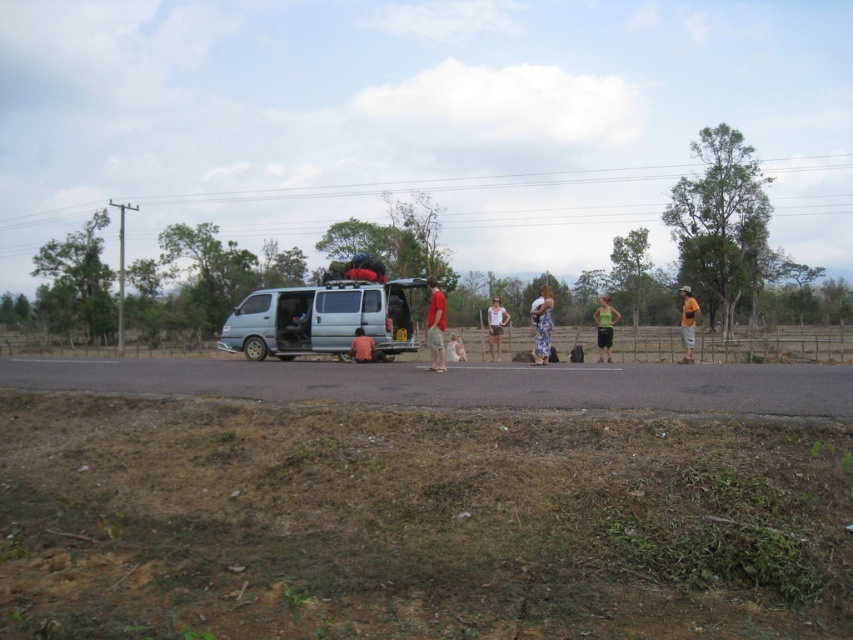
Question: Among these points, which one is farthest from the camera?

Choices:
 (A) (544, 310)
 (B) (372, 339)
 (C) (695, 308)

Answer: (B)

Question: Is green fabric shorts at center positioned before orange fabric shorts at right?

Choices:
 (A) yes
 (B) no

Answer: (B)

Question: Is floral dress at center smaller than pink fabric at center?

Choices:
 (A) yes
 (B) no

Answer: (B)

Question: Does orange fabric shorts at right have a lesser width compared to light brown fabric shorts at center?

Choices:
 (A) no
 (B) yes

Answer: (A)

Question: Which of these objects is positioned farthest from the red cotton shirt at center?

Choices:
 (A) pink fabric at center
 (B) floral dress at center

Answer: (B)

Question: Which point is farther to the camera?

Choices:
 (A) (352, 349)
 (B) (318, 332)
 (C) (450, 337)

Answer: (C)